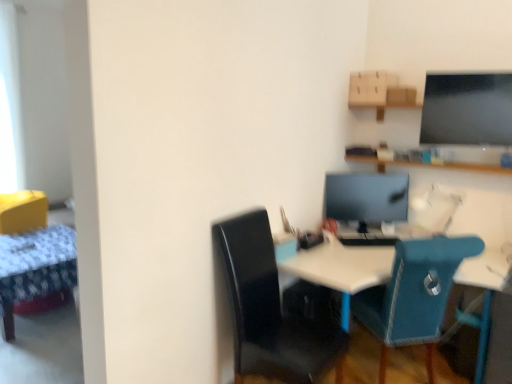
Question: Which direction should I rotate to look at black leather chair at center, which is the second chair from right to left, — up or down?

Choices:
 (A) up
 (B) down

Answer: (B)

Question: From the image's perspective, would you say black leather chair at center, which is the first chair in left-to-right order, is shown under matte black monitor at center?

Choices:
 (A) no
 (B) yes

Answer: (B)

Question: Considering the relative sizes of black leather chair at center, which is the second chair from right to left, and matte black monitor at center in the image provided, is black leather chair at center, which is the second chair from right to left, shorter than matte black monitor at center?

Choices:
 (A) yes
 (B) no

Answer: (B)

Question: Does black leather chair at center, which is the first chair in left-to-right order, appear on the right side of matte black monitor at center?

Choices:
 (A) no
 (B) yes

Answer: (A)

Question: Is black leather chair at center, which is the second chair from right to left, surrounding matte black monitor at center?

Choices:
 (A) no
 (B) yes

Answer: (A)

Question: Is black leather chair at center, which is the first chair in left-to-right order, next to matte black monitor at center and touching it?

Choices:
 (A) yes
 (B) no

Answer: (B)

Question: Can you confirm if black leather chair at center, which is the first chair in left-to-right order, is smaller than matte black monitor at center?

Choices:
 (A) no
 (B) yes

Answer: (A)

Question: Considering the relative sizes of black leather chair at center, which is the second chair from right to left, and white plastic desk at center in the image provided, is black leather chair at center, which is the second chair from right to left, taller than white plastic desk at center?

Choices:
 (A) yes
 (B) no

Answer: (A)

Question: Can you confirm if black leather chair at center, which is the first chair in left-to-right order, is thinner than white plastic desk at center?

Choices:
 (A) yes
 (B) no

Answer: (A)

Question: Is black leather chair at center, which is the first chair in left-to-right order, positioned behind white plastic desk at center?

Choices:
 (A) no
 (B) yes

Answer: (A)

Question: Is black leather chair at center, which is the first chair in left-to-right order, next to white plastic desk at center?

Choices:
 (A) no
 (B) yes

Answer: (A)

Question: Is black leather chair at center, which is the second chair from right to left, not near white plastic desk at center?

Choices:
 (A) yes
 (B) no

Answer: (B)

Question: From the image's perspective, would you say black leather chair at center, which is the second chair from right to left, is shown under white plastic desk at center?

Choices:
 (A) no
 (B) yes

Answer: (A)

Question: Considering the relative positions of matte black monitor at center and white plastic desk at center in the image provided, is matte black monitor at center to the left of white plastic desk at center from the viewer's perspective?

Choices:
 (A) no
 (B) yes

Answer: (B)